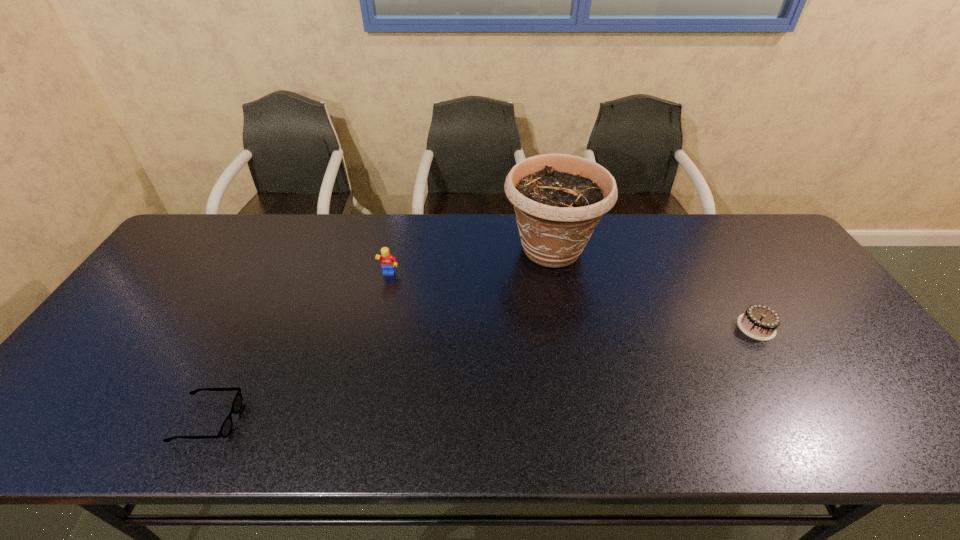
The height and width of the screenshot is (540, 960). I want to click on the second object from right to left, so click(x=558, y=199).

Identify the location of the tallest object. (558, 199).

You are a GUI agent. You are given a task and a screenshot of the screen. Output one action in this format:
    pyautogui.click(x=<x>, y=<y>)
    Task: Click on the second object from left to right
    The image size is (960, 540).
    Given the screenshot: What is the action you would take?
    pyautogui.click(x=387, y=259)

At what (x,y) coordinates should I click in order to perform the action: click on the second tallest object. Please return your answer as a coordinate pair (x, y). Looking at the image, I should click on (387, 259).

Locate an element on the screen. The width and height of the screenshot is (960, 540). the rightmost object is located at coordinates (759, 322).

In order to click on chocolate cake in this screenshot , I will do `click(759, 322)`.

The height and width of the screenshot is (540, 960). What are the coordinates of `spectacles` in the screenshot? It's located at [x=226, y=428].

Locate an element on the screen. Image resolution: width=960 pixels, height=540 pixels. the nearest object is located at coordinates (226, 428).

The width and height of the screenshot is (960, 540). What are the coordinates of `free space located on the right of the tallest object` in the screenshot? It's located at (706, 249).

Where is `vacant position located on the face of the second object from left to right`? vacant position located on the face of the second object from left to right is located at coordinates (367, 376).